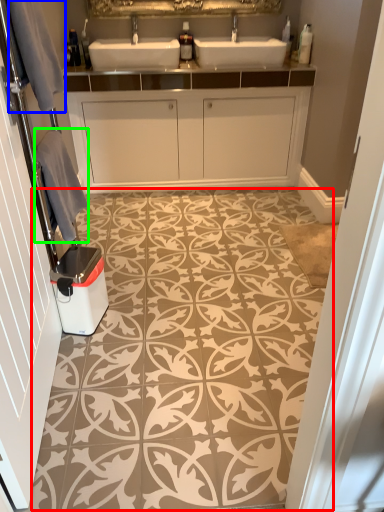
Question: Based on their relative distances, which object is farther from design (highlighted by a red box)? Choose from gray (highlighted by a blue box) and material (highlighted by a green box).

Choices:
 (A) gray
 (B) material

Answer: (A)